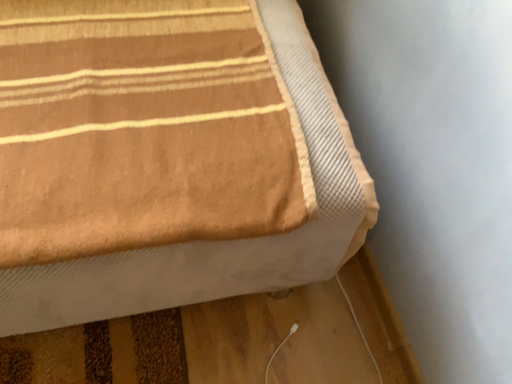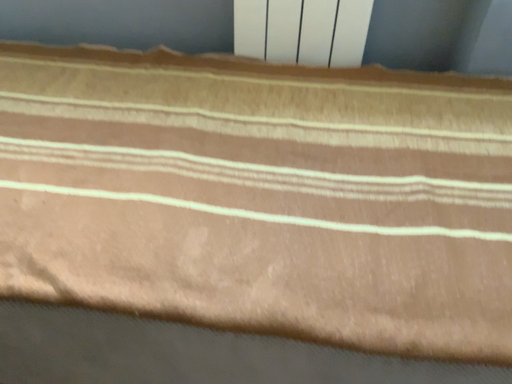
Question: How did the camera likely rotate when shooting the video?

Choices:
 (A) rotated upward
 (B) rotated downward

Answer: (A)